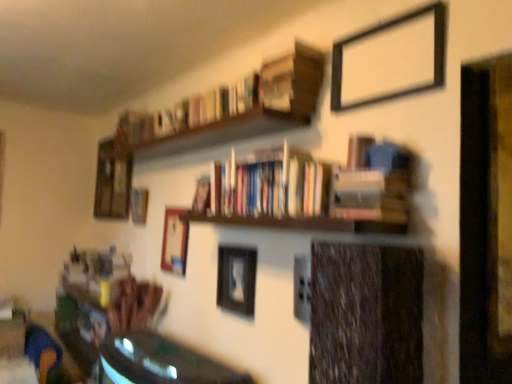
Question: Can you confirm if wooden picture frame at center, the third picture frame from the back, is smaller than hardcover books at upper center, arranged as the 3th book when ordered from the bottom?

Choices:
 (A) no
 (B) yes

Answer: (B)

Question: Considering the relative positions of wooden picture frame at center, the third picture frame viewed from the left, and hardcover books at upper center, which is counted as the first book, starting from the top, in the image provided, is wooden picture frame at center, the third picture frame viewed from the left, behind hardcover books at upper center, which is counted as the first book, starting from the top,?

Choices:
 (A) yes
 (B) no

Answer: (A)

Question: Can we say wooden picture frame at center, placed as the 4th picture frame when sorted from front to back, lies outside hardcover books at upper center, which is counted as the first book, starting from the top?

Choices:
 (A) no
 (B) yes

Answer: (B)

Question: Does wooden picture frame at center, the 4th picture frame positioned from the right, touch hardcover books at upper center, which is counted as the first book, starting from the top?

Choices:
 (A) yes
 (B) no

Answer: (B)

Question: Can you confirm if wooden picture frame at center, the third picture frame viewed from the left, is wider than hardcover books at upper center, which is counted as the first book, starting from the top?

Choices:
 (A) yes
 (B) no

Answer: (B)

Question: Considering the relative sizes of wooden picture frame at center, the third picture frame viewed from the left, and hardcover books at upper center, which is counted as the first book, starting from the top, in the image provided, is wooden picture frame at center, the third picture frame viewed from the left, thinner than hardcover books at upper center, which is counted as the first book, starting from the top,?

Choices:
 (A) yes
 (B) no

Answer: (A)

Question: Is shiny green table at lower left not within hardcover books at center, marked as the 2th book in a bottom-to-top arrangement?

Choices:
 (A) yes
 (B) no

Answer: (A)

Question: Is shiny green table at lower left thinner than hardcover books at center, marked as the 2th book in a bottom-to-top arrangement?

Choices:
 (A) no
 (B) yes

Answer: (A)

Question: Does shiny green table at lower left have a greater width compared to hardcover books at center, marked as the 2th book in a bottom-to-top arrangement?

Choices:
 (A) yes
 (B) no

Answer: (A)

Question: Does shiny green table at lower left appear on the left side of hardcover books at center, which appears as the second book when viewed from the top?

Choices:
 (A) yes
 (B) no

Answer: (A)

Question: Is hardcover books at center, which appears as the second book when viewed from the top, surrounded by shiny green table at lower left?

Choices:
 (A) yes
 (B) no

Answer: (B)

Question: Is shiny green table at lower left not close to hardcover books at center, which appears as the second book when viewed from the top?

Choices:
 (A) yes
 (B) no

Answer: (B)

Question: Is the surface of wooden picture frame at upper left, which appears as the second picture frame when viewed from the left, in direct contact with black matte picture frame at upper right, which ranks as the 2th picture frame in right-to-left order?

Choices:
 (A) yes
 (B) no

Answer: (B)